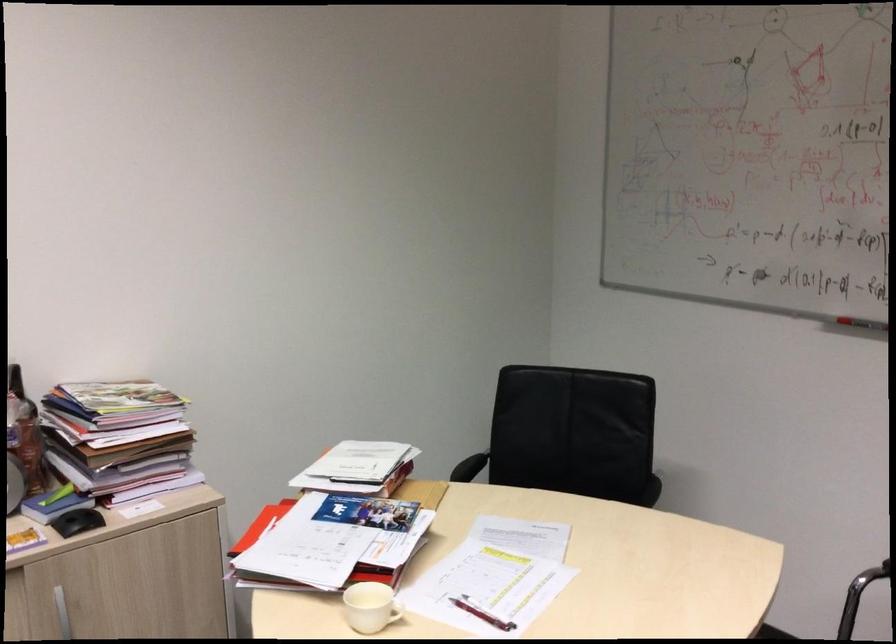
Locate an element on the screen. This screenshot has width=896, height=644. chair sitting surface is located at coordinates (515, 529).